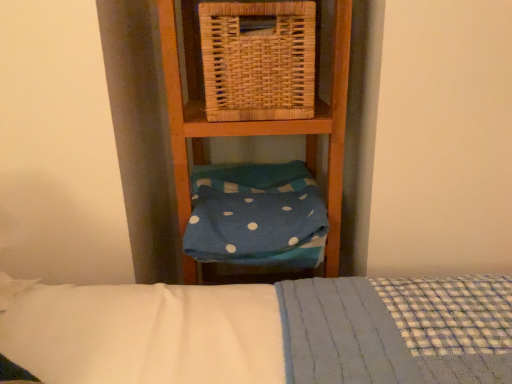
What is the approximate height of blue polka dot fabric at center?

blue polka dot fabric at center is 6.73 inches tall.

This screenshot has height=384, width=512. What do you see at coordinates (256, 215) in the screenshot? I see `blue polka dot fabric at center` at bounding box center [256, 215].

Locate an element on the screen. This screenshot has width=512, height=384. blue polka dot fabric at center is located at coordinates (256, 215).

Describe the element at coordinates (258, 61) in the screenshot. I see `woven natural picnic basket at upper center` at that location.

Locate an element on the screen. The height and width of the screenshot is (384, 512). woven natural picnic basket at upper center is located at coordinates (258, 61).

What is the approximate height of woven natural picnic basket at upper center?

woven natural picnic basket at upper center is 24.24 centimeters tall.

You are a GUI agent. You are given a task and a screenshot of the screen. Output one action in this format:
    pyautogui.click(x=<x>, y=<y>)
    Task: Click on the blue polka dot fabric at center
    Image resolution: width=512 pixels, height=384 pixels.
    Given the screenshot: What is the action you would take?
    pyautogui.click(x=256, y=215)

Based on the photo, considering the relative positions of woven natural picnic basket at upper center and blue polka dot fabric at center in the image provided, is woven natural picnic basket at upper center to the right of blue polka dot fabric at center from the viewer's perspective?

Yes.

Is woven natural picnic basket at upper center positioned behind blue polka dot fabric at center?

That is False.

Which is in front, point (222, 83) or point (281, 176)?

The point (222, 83) is closer to the camera.

From the image's perspective, is woven natural picnic basket at upper center above blue polka dot fabric at center?

Yes, from the image's perspective, woven natural picnic basket at upper center is above blue polka dot fabric at center.

From a real-world perspective, is woven natural picnic basket at upper center located beneath blue polka dot fabric at center?

No, from a real-world perspective, woven natural picnic basket at upper center is not beneath blue polka dot fabric at center.

Considering the sizes of objects woven natural picnic basket at upper center and blue polka dot fabric at center in the image provided, who is wider, woven natural picnic basket at upper center or blue polka dot fabric at center?

blue polka dot fabric at center is wider.

Is woven natural picnic basket at upper center taller than blue polka dot fabric at center?

Correct, woven natural picnic basket at upper center is much taller as blue polka dot fabric at center.

Between woven natural picnic basket at upper center and blue polka dot fabric at center, which one has larger size?

Bigger between the two is blue polka dot fabric at center.

Is blue polka dot fabric at center surrounded by woven natural picnic basket at upper center?

That's incorrect, blue polka dot fabric at center is not inside woven natural picnic basket at upper center.

Is woven natural picnic basket at upper center in contact with blue polka dot fabric at center?

There is a gap between woven natural picnic basket at upper center and blue polka dot fabric at center.

Is blue polka dot fabric at center at the back of woven natural picnic basket at upper center?

No, woven natural picnic basket at upper center is not facing away from blue polka dot fabric at center.

Measure the distance between woven natural picnic basket at upper center and blue polka dot fabric at center.

woven natural picnic basket at upper center is 11.84 inches away from blue polka dot fabric at center.

You are a GUI agent. You are given a task and a screenshot of the screen. Output one action in this format:
    pyautogui.click(x=<x>, y=<y>)
    Task: Click on the pillow behind the woven natural picnic basket at upper center
    The image size is (512, 384).
    Given the screenshot: What is the action you would take?
    pyautogui.click(x=256, y=215)

Between blue polka dot fabric at center and woven natural picnic basket at upper center, which one appears on the left side from the viewer's perspective?

Positioned to the left is blue polka dot fabric at center.

Which object is further away from the camera taking this photo, blue polka dot fabric at center or woven natural picnic basket at upper center?

Positioned behind is blue polka dot fabric at center.

Considering the points (296, 200) and (208, 23), which point is in front, point (296, 200) or point (208, 23)?

Point (208, 23)

Based on the photo, from the image's perspective, is blue polka dot fabric at center over woven natural picnic basket at upper center?

No, from the image's perspective, blue polka dot fabric at center is not on top of woven natural picnic basket at upper center.

From a real-world perspective, is blue polka dot fabric at center physically below woven natural picnic basket at upper center?

Yes, from a real-world perspective, blue polka dot fabric at center is below woven natural picnic basket at upper center.

Which of these two, blue polka dot fabric at center or woven natural picnic basket at upper center, is thinner?

A: woven natural picnic basket at upper center is thinner.

Considering the sizes of blue polka dot fabric at center and woven natural picnic basket at upper center in the image, is blue polka dot fabric at center taller or shorter than woven natural picnic basket at upper center?

blue polka dot fabric at center is shorter than woven natural picnic basket at upper center.

Looking at the image, does blue polka dot fabric at center seem bigger or smaller compared to woven natural picnic basket at upper center?

Considering their sizes, blue polka dot fabric at center takes up more space than woven natural picnic basket at upper center.

Is woven natural picnic basket at upper center located within blue polka dot fabric at center?

No, woven natural picnic basket at upper center is located outside of blue polka dot fabric at center.

Is blue polka dot fabric at center placed right next to woven natural picnic basket at upper center?

There is a gap between blue polka dot fabric at center and woven natural picnic basket at upper center.

Is blue polka dot fabric at center positioned with its back to woven natural picnic basket at upper center?

No.

Looking at this image, what's the angular difference between blue polka dot fabric at center and woven natural picnic basket at upper center's facing directions?

1.66 degrees separate the facing orientations of blue polka dot fabric at center and woven natural picnic basket at upper center.

Locate an element on the screen. The image size is (512, 384). picnic basket in front of the blue polka dot fabric at center is located at coordinates (258, 61).

Image resolution: width=512 pixels, height=384 pixels. Identify the location of pillow below the woven natural picnic basket at upper center (from a real-world perspective). (256, 215).

Where is `pillow that is behind the woven natural picnic basket at upper center`? pillow that is behind the woven natural picnic basket at upper center is located at coordinates (256, 215).